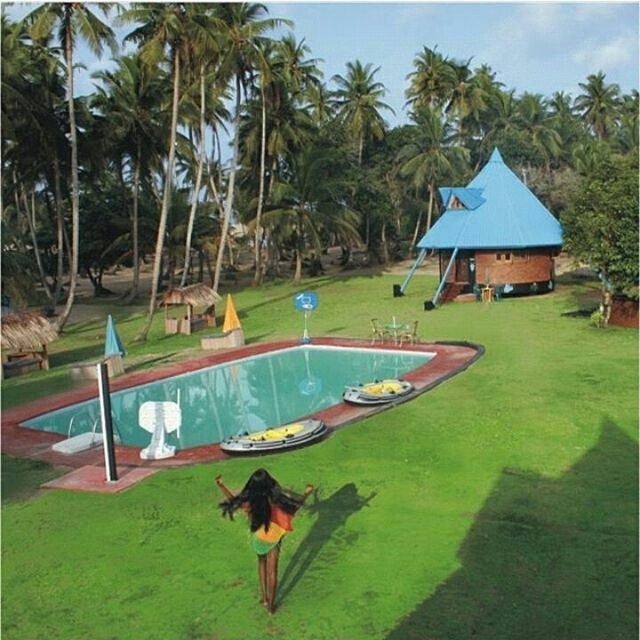
You are planning to take a photo of the blue brick hut at upper right and the green leafy palm tree at upper right from the poolside. Which object should you focus on first to ensure both are in the frame without moving the camera?

You should focus on the blue brick hut at upper right first because it is closer to the viewer than the green leafy palm tree at upper right, so adjusting focus to the closer object will help both be in the frame.

You are planning to place a small garden statue exactly between the green grass at lower center and the blue brick hut at upper right. Based on their positions, which direction should the statue face to be centered between them?

The statue should face towards the blue brick hut at upper right since the green grass at lower center is positioned on the left side of the blue brick hut at upper right, meaning the center point between them would be closer to the hut.

You are standing at the point labeled point (496, 177) in the image. The pool is directly behind you. If you want to walk to the pool, which direction should you go?

Since the pool is directly behind you at point (496, 177), you should walk forward to reach it.